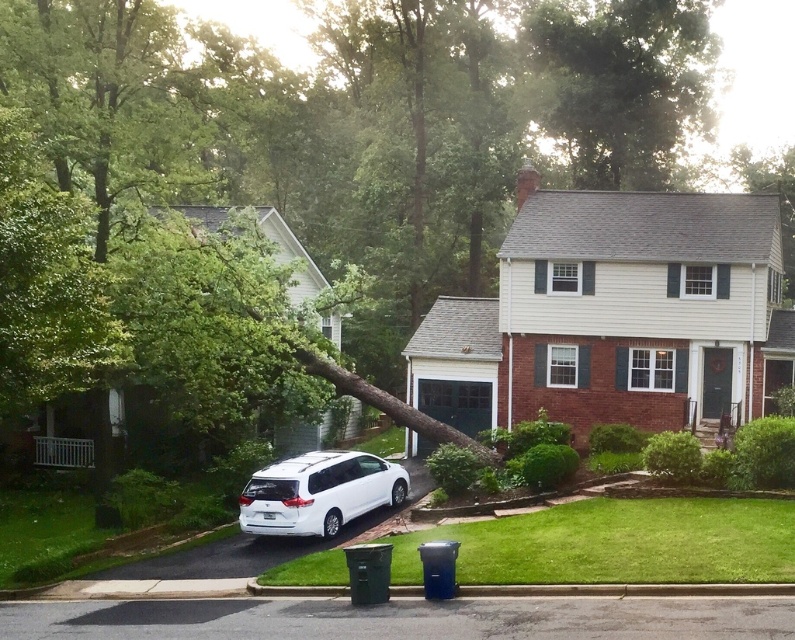
Question: Does green leafy tree at upper center appear on the left side of white matte van at lower left?

Choices:
 (A) yes
 (B) no

Answer: (B)

Question: Which point is closer to the camera taking this photo?

Choices:
 (A) (328, 518)
 (B) (565, 136)

Answer: (A)

Question: Which of the following is the closest to the observer?

Choices:
 (A) (258, 468)
 (B) (549, 40)

Answer: (A)

Question: Does green leafy tree at upper center lie behind white matte van at lower left?

Choices:
 (A) yes
 (B) no

Answer: (A)

Question: Is green leafy tree at upper center further to the viewer compared to white matte van at lower left?

Choices:
 (A) yes
 (B) no

Answer: (A)